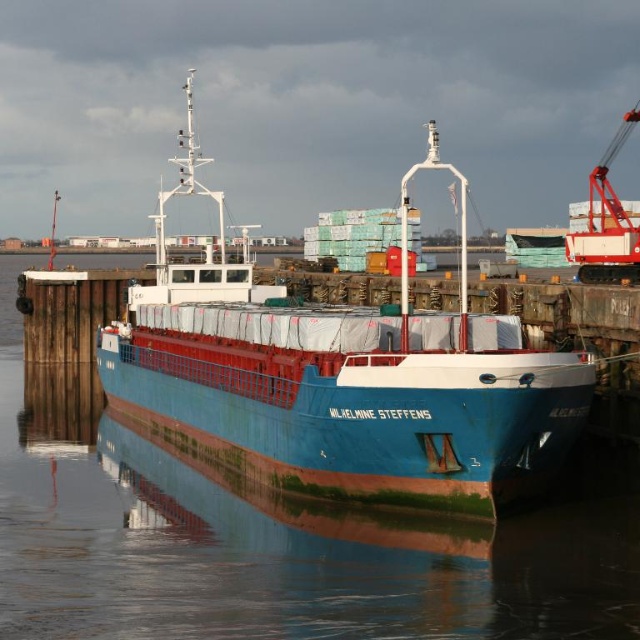
Can you confirm if blue glossy water at center is positioned to the left of blue matte cargo ship at center?

Indeed, blue glossy water at center is positioned on the left side of blue matte cargo ship at center.

Which is more to the right, blue glossy water at center or blue matte cargo ship at center?

blue matte cargo ship at center is more to the right.

Locate an element on the screen. blue glossy water at center is located at coordinates (282, 538).

At what (x,y) coordinates should I click in order to perform the action: click on blue glossy water at center. Please return your answer as a coordinate pair (x, y). This screenshot has height=640, width=640. Looking at the image, I should click on (282, 538).